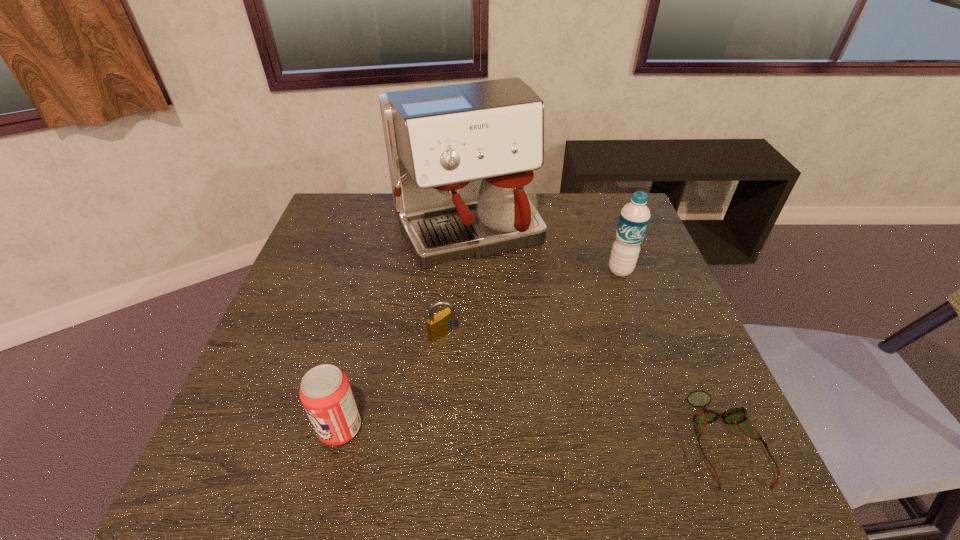
Locate an element on the screen. This screenshot has height=540, width=960. spectacles at the near edge is located at coordinates (739, 416).

Where is `spectacles present at the right edge`? This screenshot has width=960, height=540. spectacles present at the right edge is located at coordinates coord(739,416).

Locate an element on the screen. The height and width of the screenshot is (540, 960). water bottle at the right edge is located at coordinates (634, 217).

Image resolution: width=960 pixels, height=540 pixels. Identify the location of object at the near right corner. (739, 416).

This screenshot has width=960, height=540. Find the location of `blank space at the far edge of the desktop`. blank space at the far edge of the desktop is located at coordinates click(x=572, y=199).

At what (x,y) coordinates should I click in order to perform the action: click on free space at the near edge. Please return your answer as a coordinate pair (x, y). This screenshot has width=960, height=540. Looking at the image, I should click on (621, 422).

Where is `blank area at the left edge`? blank area at the left edge is located at coordinates (304, 298).

In the image, there is a desktop. Where is `free space at the right edge`? The image size is (960, 540). free space at the right edge is located at coordinates (664, 290).

The image size is (960, 540). What are the coordinates of `vacant region at the far left corner of the desktop` in the screenshot? It's located at (355, 234).

You are a GUI agent. You are given a task and a screenshot of the screen. Output one action in this format:
    pyautogui.click(x=<x>, y=<y>)
    Task: Click on the vacant area at the near left corner of the desktop
    This screenshot has width=960, height=540.
    Given the screenshot: What is the action you would take?
    pyautogui.click(x=255, y=410)